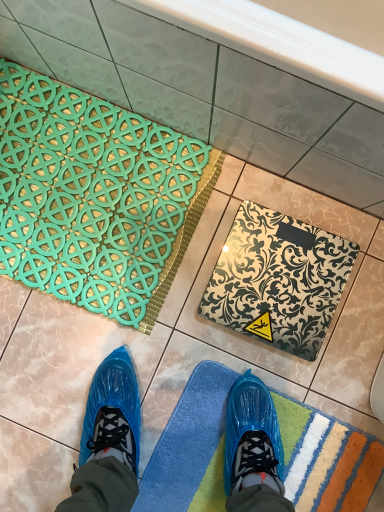
Question: From a real-world perspective, is blue textured bath mat at lower center, which is the first bath mat from bottom to top, below teal rubber bath mat at upper left, the 1th bath mat from the top?

Choices:
 (A) no
 (B) yes

Answer: (B)

Question: Is blue textured bath mat at lower center, positioned as the 3th bath mat in top-to-bottom order, to the left of teal rubber bath mat at upper left, the 1th bath mat from the top, from the viewer's perspective?

Choices:
 (A) no
 (B) yes

Answer: (A)

Question: Is blue textured bath mat at lower center, which is the first bath mat from bottom to top, smaller than teal rubber bath mat at upper left, the 1th bath mat from the top?

Choices:
 (A) no
 (B) yes

Answer: (B)

Question: Is blue textured bath mat at lower center, which is the first bath mat from bottom to top, looking in the opposite direction of teal rubber bath mat at upper left, the 1th bath mat from the top?

Choices:
 (A) no
 (B) yes

Answer: (A)

Question: From the image's perspective, is blue textured bath mat at lower center, positioned as the 3th bath mat in top-to-bottom order, below teal rubber bath mat at upper left, the 1th bath mat from the top?

Choices:
 (A) no
 (B) yes

Answer: (B)

Question: From a real-world perspective, is teal rubber bath mat at upper left, which is counted as the 3th bath mat, starting from the bottom, positioned above or below metallic silver scale at center, the 2th bath mat from the bottom?

Choices:
 (A) below
 (B) above

Answer: (A)

Question: In terms of height, does teal rubber bath mat at upper left, the 1th bath mat from the top, look taller or shorter compared to metallic silver scale at center, the 2th bath mat positioned from the top?

Choices:
 (A) short
 (B) tall

Answer: (A)

Question: Considering the relative positions of teal rubber bath mat at upper left, the 1th bath mat from the top, and metallic silver scale at center, the 2th bath mat positioned from the top, in the image provided, is teal rubber bath mat at upper left, the 1th bath mat from the top, to the left or to the right of metallic silver scale at center, the 2th bath mat positioned from the top,?

Choices:
 (A) right
 (B) left

Answer: (B)

Question: Is teal rubber bath mat at upper left, the 1th bath mat from the top, inside the boundaries of metallic silver scale at center, the 2th bath mat from the bottom, or outside?

Choices:
 (A) outside
 (B) inside

Answer: (A)

Question: Would you say blue textured bath mat at lower center, positioned as the 3th bath mat in top-to-bottom order, is inside or outside teal rubber bath mat at upper left, which is counted as the 3th bath mat, starting from the bottom?

Choices:
 (A) outside
 (B) inside

Answer: (A)

Question: From a real-world perspective, relative to teal rubber bath mat at upper left, which is counted as the 3th bath mat, starting from the bottom, is blue textured bath mat at lower center, which is the first bath mat from bottom to top, vertically above or below?

Choices:
 (A) above
 (B) below

Answer: (B)

Question: Considering the positions of point (334, 431) and point (64, 294), is point (334, 431) closer or farther from the camera than point (64, 294)?

Choices:
 (A) closer
 (B) farther

Answer: (A)

Question: In terms of width, does blue textured bath mat at lower center, which is the first bath mat from bottom to top, look wider or thinner when compared to teal rubber bath mat at upper left, the 1th bath mat from the top?

Choices:
 (A) wide
 (B) thin

Answer: (A)

Question: Choose the correct answer: Is metallic silver scale at center, the 2th bath mat positioned from the top, inside teal rubber bath mat at upper left, which is counted as the 3th bath mat, starting from the bottom, or outside it?

Choices:
 (A) outside
 (B) inside

Answer: (A)

Question: From the image's perspective, is metallic silver scale at center, the 2th bath mat positioned from the top, positioned above or below teal rubber bath mat at upper left, the 1th bath mat from the top?

Choices:
 (A) below
 (B) above

Answer: (A)